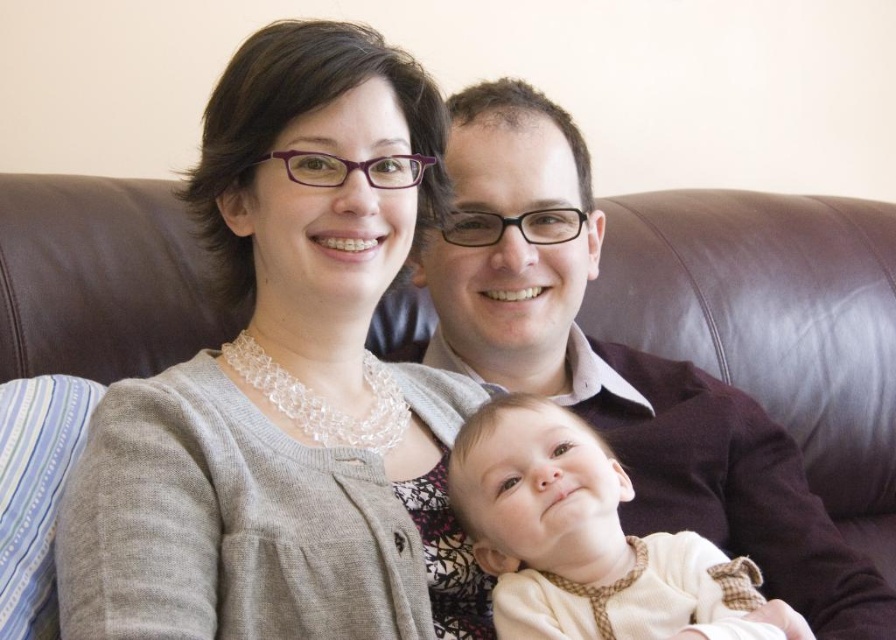
Question: Is gray knitted sweater at upper left bigger than matte brown leather couch at center?

Choices:
 (A) yes
 (B) no

Answer: (B)

Question: Which object appears closest to the camera in this image?

Choices:
 (A) light beige soft fabric baby at center
 (B) gray knitted sweater at upper left
 (C) matte brown leather couch at center

Answer: (B)

Question: Is gray knitted sweater at upper left thinner than matte brown leather couch at center?

Choices:
 (A) yes
 (B) no

Answer: (A)

Question: From the image, what is the correct spatial relationship of gray knitted sweater at upper left in relation to matte brown leather couch at center?

Choices:
 (A) below
 (B) above

Answer: (B)

Question: Based on their relative distances, which object is farther from the light beige soft fabric baby at center?

Choices:
 (A) gray knitted sweater at upper left
 (B) matte brown leather couch at center

Answer: (B)

Question: Which object appears closest to the camera in this image?

Choices:
 (A) light beige soft fabric baby at center
 (B) matte brown leather couch at center
 (C) gray knitted sweater at upper left

Answer: (C)